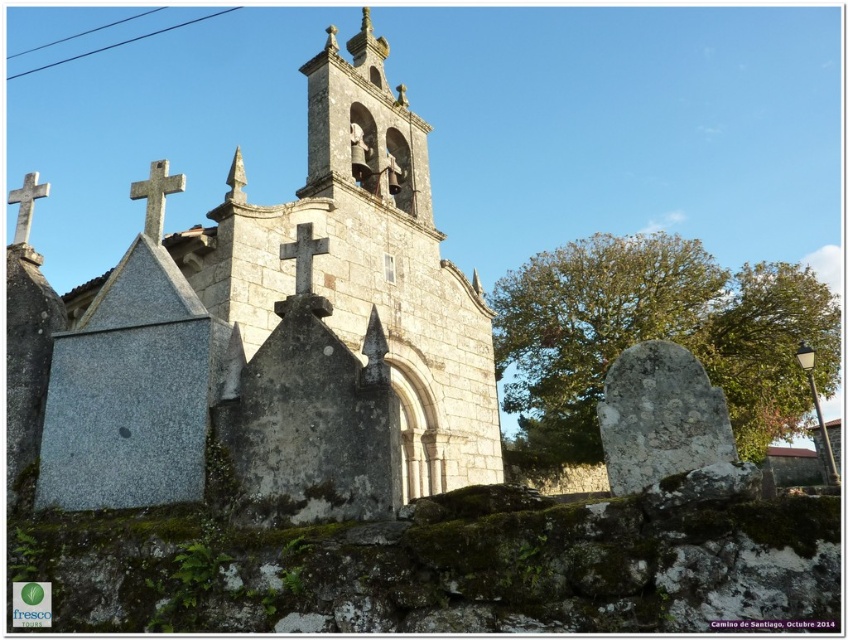
Is gray stone gravestone at center to the left of white stone cross at upper left from the viewer's perspective?

Incorrect, gray stone gravestone at center is not on the left side of white stone cross at upper left.

Which is behind, point (623, 456) or point (28, 177)?

Point (28, 177)

The height and width of the screenshot is (640, 848). Identify the location of gray stone gravestone at center. (659, 417).

Which is above, granite church at center or white stone cross at upper left?

white stone cross at upper left is above.

Can you confirm if granite church at center is shorter than white stone cross at upper left?

No, granite church at center is not shorter than white stone cross at upper left.

Looking at this image, who is more forward, [272,268] or [25,202]?

Point [25,202]

Find the location of a particular element. granite church at center is located at coordinates (285, 337).

Can you confirm if black stone cross at center is positioned above white stone cross at upper left?

No, black stone cross at center is not above white stone cross at upper left.

Which is above, black stone cross at center or white stone cross at upper left?

white stone cross at upper left

Who is more distant from viewer, (318, 243) or (26, 212)?

The point (26, 212) is more distant.

Where is `black stone cross at center`? The height and width of the screenshot is (640, 848). black stone cross at center is located at coordinates (303, 256).